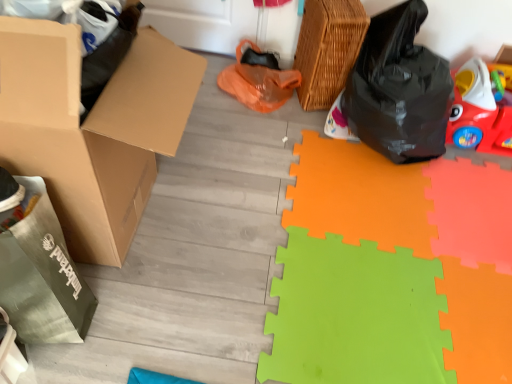
Question: From their relative heights in the image, would you say rubberized red car at right is taller or shorter than brown cardboard box at left?

Choices:
 (A) short
 (B) tall

Answer: (A)

Question: Is rubberized red car at right in front of or behind brown cardboard box at left in the image?

Choices:
 (A) behind
 (B) front

Answer: (A)

Question: Which object is positioned closest to the brown cardboard box at left?

Choices:
 (A) black plastic bag at right
 (B) woven brown basket at upper right
 (C) rubberized red car at right
 (D) green foam mat at lower right

Answer: (D)

Question: Which object is the farthest from the rubberized red car at right?

Choices:
 (A) woven brown basket at upper right
 (B) green foam mat at lower right
 (C) black plastic bag at right
 (D) brown cardboard box at left

Answer: (D)